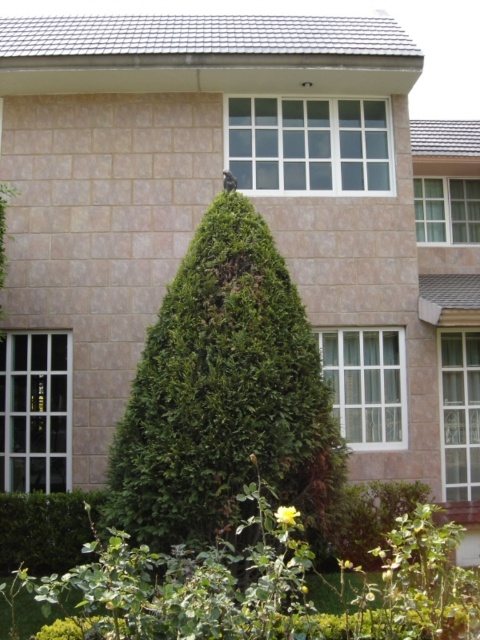
How distant is green leafy tree at center from clear glass window at center?

A distance of 4.73 meters exists between green leafy tree at center and clear glass window at center.

Which is more to the right, green leafy tree at center or clear glass window at center?

From the viewer's perspective, clear glass window at center appears more on the right side.

Which is behind, point (264, 396) or point (294, 152)?

The point (294, 152) is behind.

This screenshot has width=480, height=640. I want to click on green leafy tree at center, so click(x=226, y=397).

Measure the distance between clear glass window at left and camera.

They are 34.27 feet apart.

Identify the location of clear glass window at left. This screenshot has width=480, height=640. (35, 412).

Does green leafy tree at center appear on the left side of clear glass window at upper right?

Yes, green leafy tree at center is to the left of clear glass window at upper right.

Is green leafy tree at center shorter than clear glass window at upper right?

Incorrect, green leafy tree at center's height does not fall short of clear glass window at upper right's.

Where is `green leafy tree at center`? The height and width of the screenshot is (640, 480). green leafy tree at center is located at coordinates pos(226,397).

Identify the location of green leafy tree at center. (226, 397).